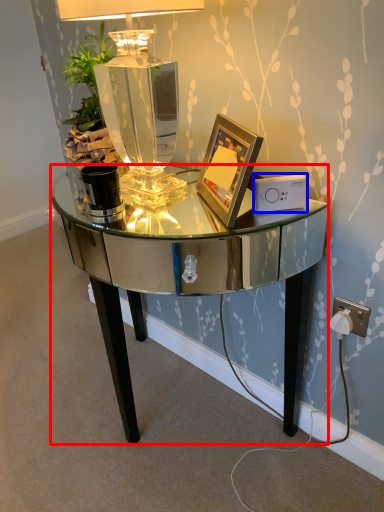
Question: Among these objects, which one is nearest to the camera, desk (highlighted by a red box) or ipod (highlighted by a blue box)?

Choices:
 (A) desk
 (B) ipod

Answer: (A)